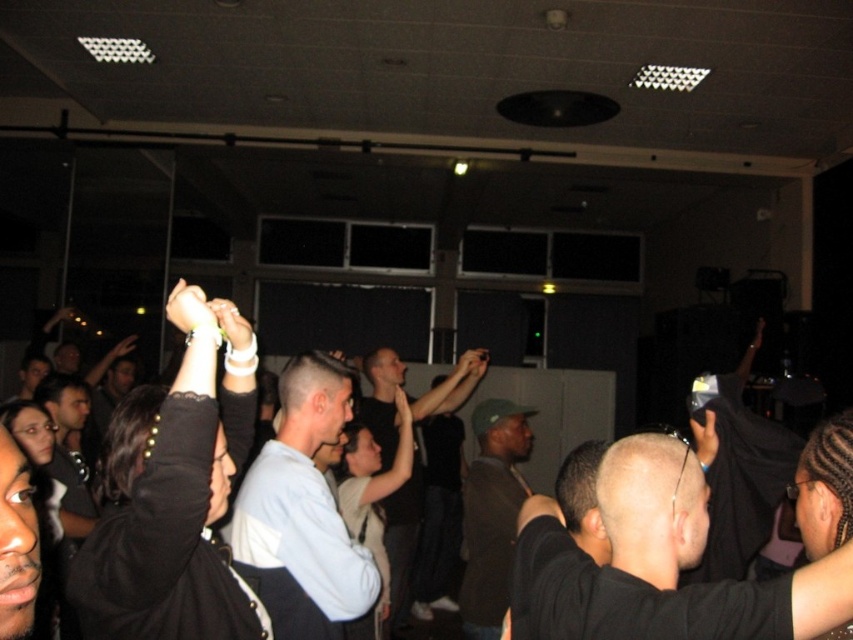
Can you confirm if black matte shirt at center is taller than white matte shirt at center?

No.

Is point (648, 528) less distant than point (334, 388)?

Yes, point (648, 528) is in front of point (334, 388).

Where is `black matte shirt at center`? black matte shirt at center is located at coordinates (659, 564).

Is black matte jacket at center positioned in front of black matte shirt at center?

No, black matte jacket at center is further to the viewer.

Who is lower down, black matte jacket at center or black matte shirt at center?

black matte shirt at center is lower down.

Identify the location of black matte jacket at center. The image size is (853, 640). (173, 493).

Is black matte shirt at center to the left of green matte cap at center from the viewer's perspective?

Incorrect, black matte shirt at center is not on the left side of green matte cap at center.

Between black matte shirt at center and green matte cap at center, which one appears on the left side from the viewer's perspective?

green matte cap at center

Image resolution: width=853 pixels, height=640 pixels. I want to click on black matte shirt at center, so click(659, 564).